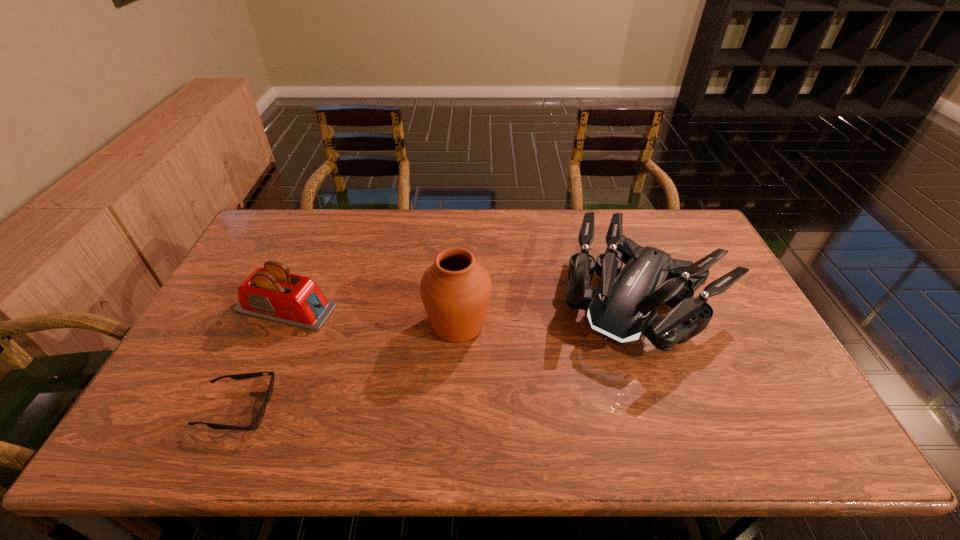
Where is `vacant space at the right edge of the desktop`? This screenshot has width=960, height=540. vacant space at the right edge of the desktop is located at coordinates (739, 338).

At what (x,y) coordinates should I click in order to perform the action: click on unoccupied position between the sunglasses and the drone. Please return your answer as a coordinate pair (x, y). Looking at the image, I should click on (441, 355).

Locate an element on the screen. The width and height of the screenshot is (960, 540). vacant space that's between the shortest object and the urn is located at coordinates (348, 366).

Identify the location of free space between the sunglasses and the toaster. (262, 359).

Where is `free spot between the rightmost object and the tallest object`? The width and height of the screenshot is (960, 540). free spot between the rightmost object and the tallest object is located at coordinates (550, 313).

Where is `unoccupied area between the toaster and the tallest object`? This screenshot has width=960, height=540. unoccupied area between the toaster and the tallest object is located at coordinates (372, 316).

At what (x,y) coordinates should I click in order to perform the action: click on empty space that is in between the toaster and the urn. Please return your answer as a coordinate pair (x, y). Looking at the image, I should click on (372, 316).

Identify the location of empty location between the tallest object and the toaster. (372, 316).

You are a GUI agent. You are given a task and a screenshot of the screen. Output one action in this format:
    pyautogui.click(x=<x>, y=<y>)
    Task: Click on the free space between the toaster and the nearest object
    The height and width of the screenshot is (540, 960).
    Given the screenshot: What is the action you would take?
    pyautogui.click(x=262, y=359)

Locate an element on the screen. object identified as the third closest to the tallest object is located at coordinates (257, 420).